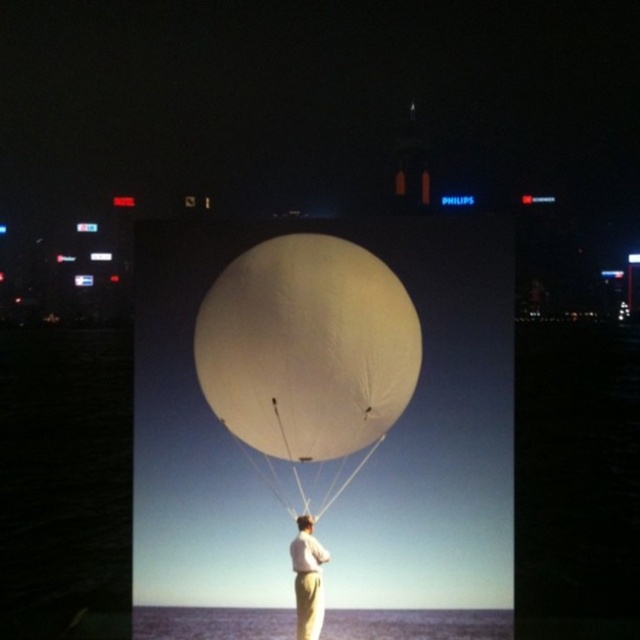
Question: Which object is positioned closest to the transparent plastic water at lower center?

Choices:
 (A) white matte balloon at center
 (B) light beige pants at center

Answer: (B)

Question: Is white matte balloon at center closer to the viewer compared to transparent plastic water at lower center?

Choices:
 (A) no
 (B) yes

Answer: (B)

Question: Does white matte balloon at center come behind light beige pants at center?

Choices:
 (A) yes
 (B) no

Answer: (A)

Question: Observing the image, what is the correct spatial positioning of white matte balloon at center in reference to transparent plastic water at lower center?

Choices:
 (A) right
 (B) left

Answer: (B)

Question: Which object is farther from the camera taking this photo?

Choices:
 (A) light beige pants at center
 (B) transparent plastic water at lower center

Answer: (B)

Question: Which object appears closest to the camera in this image?

Choices:
 (A) transparent plastic water at lower center
 (B) light beige pants at center
 (C) white matte balloon at center

Answer: (B)